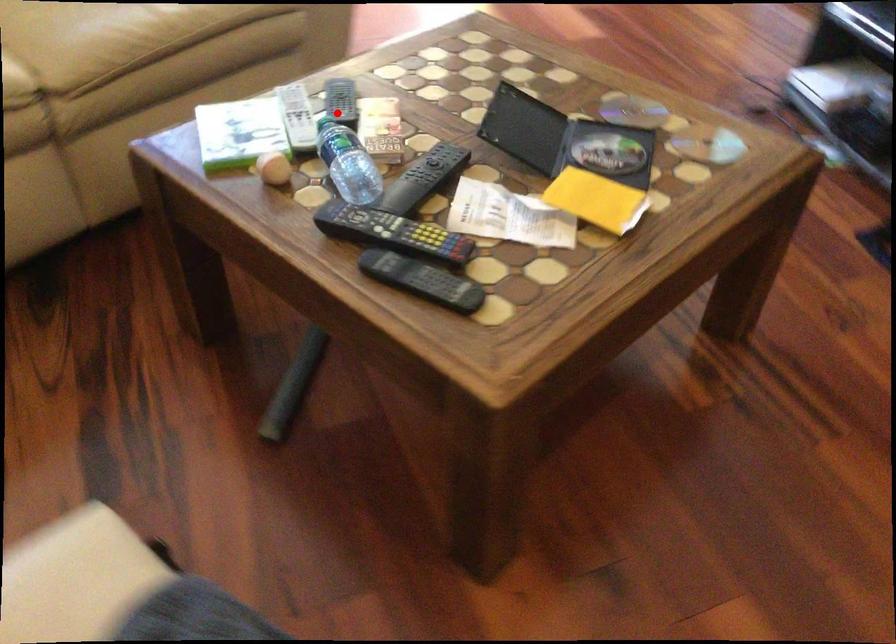
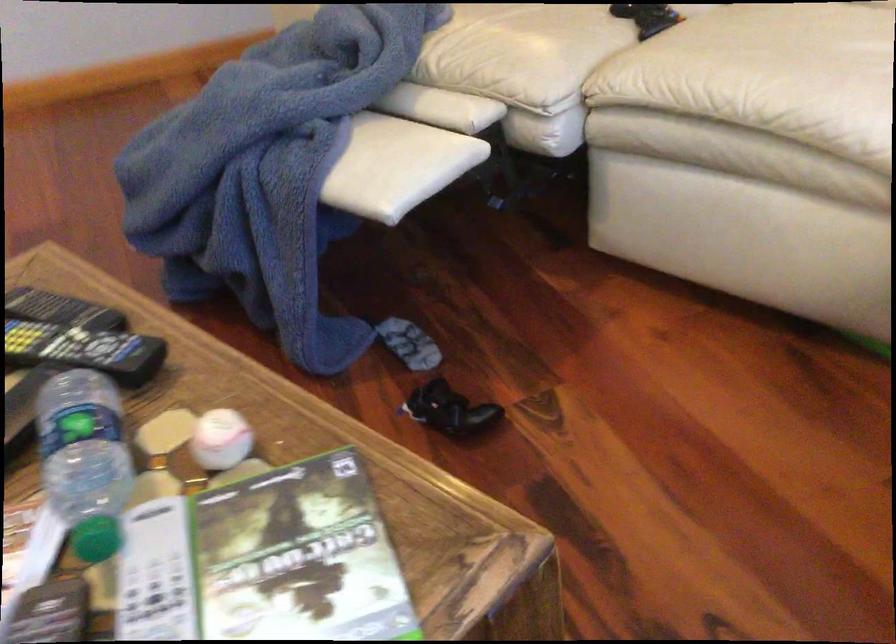
Where in the second image is the point corresponding to the highlighted location from the first image?

(96, 538)